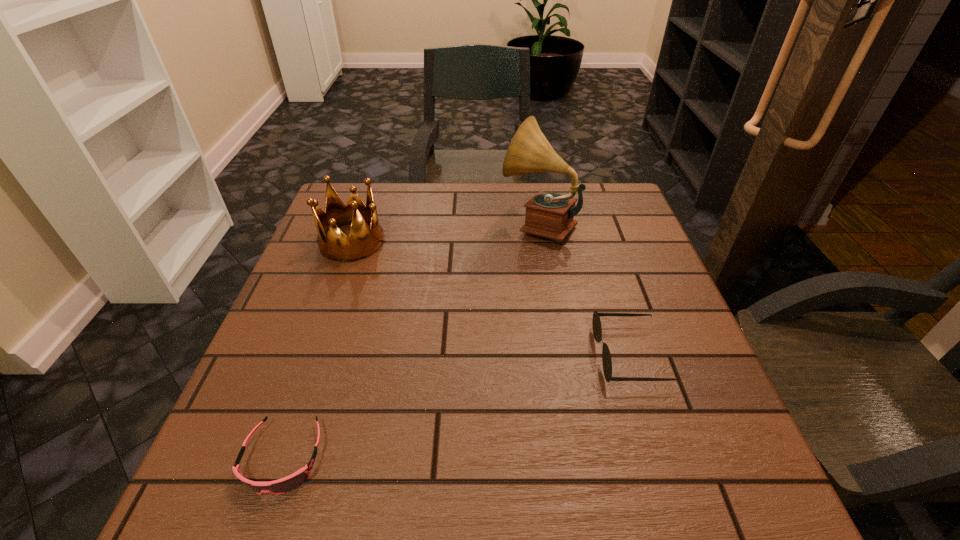
I want to click on object that is at the near left corner, so (286, 484).

At what (x,y) coordinates should I click in order to perform the action: click on vacant space at the far edge of the desktop. Please return your answer as a coordinate pair (x, y). This screenshot has height=540, width=960. Looking at the image, I should click on (535, 186).

Identify the location of vacant space at the near edge of the desktop. The height and width of the screenshot is (540, 960). (388, 497).

What are the coordinates of `free space at the left edge of the desktop` in the screenshot? It's located at (315, 248).

What are the coordinates of `vacant space at the right edge` in the screenshot? It's located at (692, 416).

The width and height of the screenshot is (960, 540). In order to click on vacant space at the far right corner in this screenshot , I will do `click(606, 226)`.

What are the coordinates of `vacant region at the near right corner of the desktop` in the screenshot? It's located at pyautogui.click(x=734, y=480).

Identify the location of free area in between the nearest object and the crown. (318, 349).

Locate an element on the screen. free space between the third shortest object and the sunglasses is located at coordinates (491, 299).

What are the coordinates of `free area in between the crown and the sunglasses` in the screenshot? It's located at (491, 299).